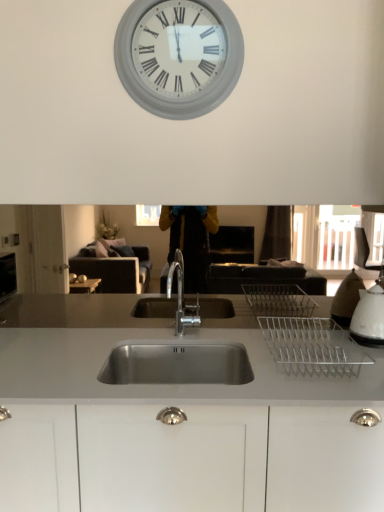
Where is `free space underneath white matte clock at upper center (from a real-world perspective)`? The width and height of the screenshot is (384, 512). free space underneath white matte clock at upper center (from a real-world perspective) is located at coordinates (203, 329).